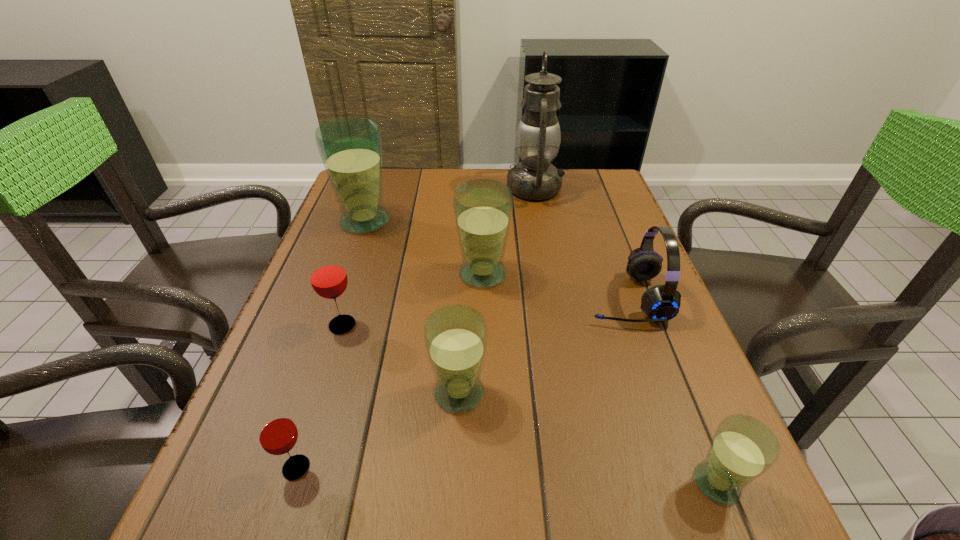
Where is `free space between the smaller red glass and the nearest blue glass`? This screenshot has height=540, width=960. free space between the smaller red glass and the nearest blue glass is located at coordinates (507, 475).

At what (x,y) coordinates should I click in order to perform the action: click on free space between the headset and the nearest blue glass. Please return your answer as a coordinate pair (x, y). Looking at the image, I should click on (671, 390).

You are a GUI agent. You are given a task and a screenshot of the screen. Output one action in this format:
    pyautogui.click(x=<x>, y=<y>)
    Task: Click on the vacant region between the nearer red glass and the farther red glass
    This screenshot has width=960, height=540.
    Given the screenshot: What is the action you would take?
    pyautogui.click(x=320, y=396)

Where is `free space that is in between the seventh shortest object and the nearer red glass`? free space that is in between the seventh shortest object and the nearer red glass is located at coordinates point(330,345).

I want to click on empty space that is in between the bigger red glass and the oil lamp, so click(x=439, y=256).

What are the coordinates of `free spot between the biggest blue glass and the fifth nearest glass` in the screenshot? It's located at (423, 247).

Image resolution: width=960 pixels, height=540 pixels. I want to click on the sixth closest object to the headset, so click(x=350, y=148).

Select which object appears as the closest to the third nearest glass. Please provide its 2D coordinates. Your answer should be formatted as a tuple, i.e. [(x, y)], where the tuple contains the x and y coordinates of a point satisfying the conditions above.

[(328, 277)]

Where is `glass object that ranks as the sixth closest to the tallest object`? The height and width of the screenshot is (540, 960). glass object that ranks as the sixth closest to the tallest object is located at coordinates click(x=277, y=433).

Identify which glass is located as the nearest to the headset. Please provide its 2D coordinates. Your answer should be formatted as a tuple, i.e. [(x, y)], where the tuple contains the x and y coordinates of a point satisfying the conditions above.

[(483, 208)]